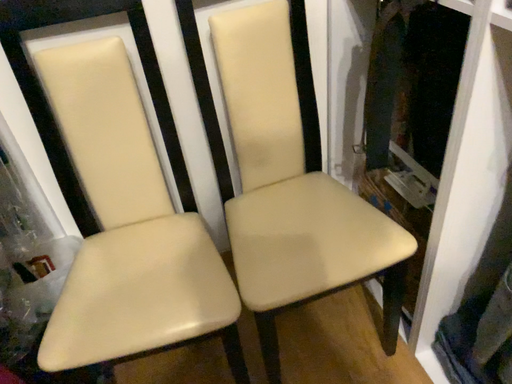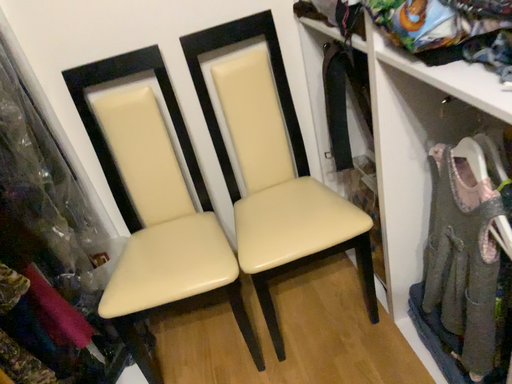
Question: How did the camera likely rotate when shooting the video?

Choices:
 (A) rotated right
 (B) rotated left

Answer: (B)